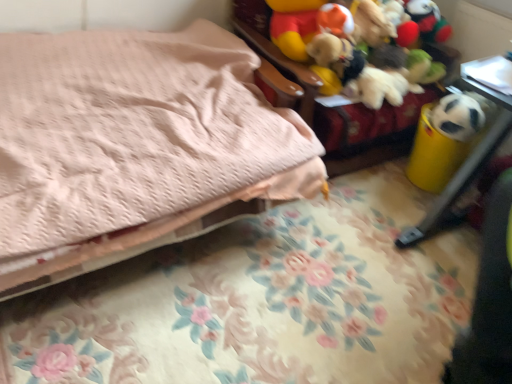
Question: Considering the positions of pink quilted bed at upper left and yellow plastic trash can at right, positioned as the 2th furniture in top-to-bottom order, in the image, is pink quilted bed at upper left bigger or smaller than yellow plastic trash can at right, positioned as the 2th furniture in top-to-bottom order,?

Choices:
 (A) big
 (B) small

Answer: (A)

Question: Looking at their shapes, would you say pink quilted bed at upper left is wider or thinner than yellow plastic trash can at right, the 1th furniture from the bottom?

Choices:
 (A) thin
 (B) wide

Answer: (B)

Question: Considering the real-world distances, which object is closest to the white matte panda at right?

Choices:
 (A) pink quilted bed at upper left
 (B) soft fabric stuffed toys at upper right, which ranks as the 1th furniture in top-to-bottom order
 (C) yellow plastic trash can at right, the 1th furniture from the bottom

Answer: (C)

Question: Which object is positioned closest to the white matte panda at right?

Choices:
 (A) soft fabric stuffed toys at upper right, the 2th furniture in the bottom-to-top sequence
 (B) yellow plastic trash can at right, positioned as the 2th furniture in top-to-bottom order
 (C) pink quilted bed at upper left

Answer: (B)